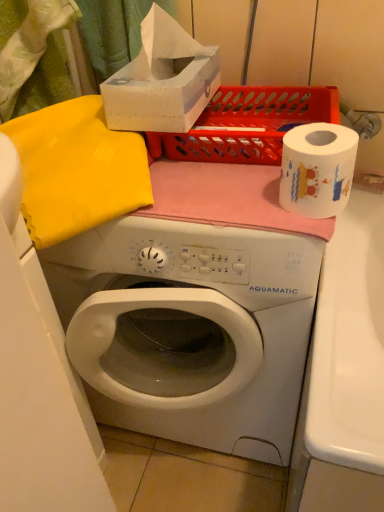
Measure the distance between white cardboard tissue box at upper center and camera.

white cardboard tissue box at upper center is 26.39 inches away from camera.

What are the coordinates of `white cardboard tissue box at upper center` in the screenshot? It's located at (162, 80).

Describe the element at coordinates (190, 329) in the screenshot. Image resolution: width=384 pixels, height=512 pixels. I see `white plastic washing machine at center` at that location.

I want to click on white cardboard tissue box at upper center, so click(162, 80).

How different are the orientations of white paper at right and matte plastic crate at upper center in degrees?

The angle between the facing direction of white paper at right and the facing direction of matte plastic crate at upper center is 0.887 degrees.

Which is more to the right, white paper at right or matte plastic crate at upper center?

From the viewer's perspective, white paper at right appears more on the right side.

From a real-world perspective, relative to matte plastic crate at upper center, is white paper at right vertically above or below?

From a real-world perspective, white paper at right is physically above matte plastic crate at upper center.

Image resolution: width=384 pixels, height=512 pixels. I want to click on box behind the white plastic washing machine at center, so click(x=162, y=80).

What's the angular difference between white plastic washing machine at center and white cardboard tissue box at upper center's facing directions?

There is a 0.887-degree angle between the facing directions of white plastic washing machine at center and white cardboard tissue box at upper center.

From their relative heights in the image, would you say white plastic washing machine at center is taller or shorter than white cardboard tissue box at upper center?

white plastic washing machine at center is taller than white cardboard tissue box at upper center.

Based on their positions, is white plastic washing machine at center located to the left or right of white cardboard tissue box at upper center?

Clearly, white plastic washing machine at center is on the right of white cardboard tissue box at upper center in the image.

Is white cardboard tissue box at upper center outside of matte plastic crate at upper center?

That's correct, white cardboard tissue box at upper center is outside of matte plastic crate at upper center.

Does point (115, 75) appear closer or farther from the camera than point (306, 94)?

Clearly, point (115, 75) is closer to the camera than point (306, 94).

Are white cardboard tissue box at upper center and matte plastic crate at upper center far apart?

white cardboard tissue box at upper center is actually quite close to matte plastic crate at upper center.

Which object is positioned more to the right, white cardboard tissue box at upper center or matte plastic crate at upper center?

matte plastic crate at upper center is more to the right.

Is white plastic washing machine at center situated inside matte plastic crate at upper center or outside?

white plastic washing machine at center exists outside the volume of matte plastic crate at upper center.

Where is `crate on the right of the white plastic washing machine at center`? crate on the right of the white plastic washing machine at center is located at coordinates (247, 124).

Considering the sizes of objects white plastic washing machine at center and matte plastic crate at upper center in the image provided, who is smaller, white plastic washing machine at center or matte plastic crate at upper center?

Smaller between the two is matte plastic crate at upper center.

Does white plastic washing machine at center touch matte plastic crate at upper center?

No, white plastic washing machine at center is not next to matte plastic crate at upper center.

Is white cardboard tissue box at upper center inside the boundaries of white plastic washing machine at center, or outside?

white cardboard tissue box at upper center is outside white plastic washing machine at center.

Is white cardboard tissue box at upper center to the left of white plastic washing machine at center from the viewer's perspective?

Indeed, white cardboard tissue box at upper center is positioned on the left side of white plastic washing machine at center.

Which object is further away from the camera, matte plastic crate at upper center or white plastic washing machine at center?

matte plastic crate at upper center.

Is matte plastic crate at upper center facing towards white plastic washing machine at center?

No, matte plastic crate at upper center is not oriented towards white plastic washing machine at center.

How far apart are matte plastic crate at upper center and white plastic washing machine at center?

matte plastic crate at upper center is 14.65 inches away from white plastic washing machine at center.

Is matte plastic crate at upper center facing away from white cardboard tissue box at upper center?

No.

Find the location of a particular element. box in front of the matte plastic crate at upper center is located at coordinates (162, 80).

Are matte plastic crate at upper center and white cardboard tissue box at upper center beside each other?

No, matte plastic crate at upper center is not with white cardboard tissue box at upper center.

Considering the positions of objects matte plastic crate at upper center and white cardboard tissue box at upper center in the image provided, who is more to the left, matte plastic crate at upper center or white cardboard tissue box at upper center?

From the viewer's perspective, white cardboard tissue box at upper center appears more on the left side.

Where is `crate above the white paper at right (from the image's perspective)`? This screenshot has height=512, width=384. crate above the white paper at right (from the image's perspective) is located at coordinates (247, 124).

Image resolution: width=384 pixels, height=512 pixels. In order to click on washing machine below the white cardboard tissue box at upper center (from a real-world perspective) in this screenshot , I will do `click(190, 329)`.

Estimate the real-world distances between objects in this image. Which object is further from matte plastic crate at upper center, white plastic washing machine at center or white cardboard tissue box at upper center?

white plastic washing machine at center is further to matte plastic crate at upper center.

Looking at this image, which object lies further to the anchor point white plastic washing machine at center, matte plastic crate at upper center or white paper at right?

Based on the image, matte plastic crate at upper center appears to be further to white plastic washing machine at center.

Considering their positions, is white paper at right positioned closer to matte plastic crate at upper center than white cardboard tissue box at upper center?

white cardboard tissue box at upper center is positioned closer to the anchor matte plastic crate at upper center.

Looking at this image, estimate the real-world distances between objects in this image. Which object is further from white plastic washing machine at center, white paper at right or matte plastic crate at upper center?

Among the two, matte plastic crate at upper center is located further to white plastic washing machine at center.

Considering their positions, is white plastic washing machine at center positioned closer to matte plastic crate at upper center than white paper at right?

white paper at right is positioned closer to the anchor matte plastic crate at upper center.

Which object lies further to the anchor point white cardboard tissue box at upper center, white paper at right or white plastic washing machine at center?

white plastic washing machine at center is positioned further to the anchor white cardboard tissue box at upper center.

From the image, which object appears to be nearer to white paper at right, matte plastic crate at upper center or white plastic washing machine at center?

matte plastic crate at upper center is closer to white paper at right.

Considering their positions, is matte plastic crate at upper center positioned further to white cardboard tissue box at upper center than white paper at right?

white paper at right is further to white cardboard tissue box at upper center.

The image size is (384, 512). What are the coordinates of `crate between white cardboard tissue box at upper center and white paper at right in the vertical direction` in the screenshot? It's located at (247, 124).

The height and width of the screenshot is (512, 384). I want to click on paper towel between matte plastic crate at upper center and white plastic washing machine at center vertically, so click(x=317, y=169).

The height and width of the screenshot is (512, 384). Find the location of `crate between white cardboard tissue box at upper center and white plastic washing machine at center in the up-down direction`. crate between white cardboard tissue box at upper center and white plastic washing machine at center in the up-down direction is located at coordinates point(247,124).

This screenshot has width=384, height=512. In order to click on paper towel between white cardboard tissue box at upper center and white plastic washing machine at center in the up-down direction in this screenshot , I will do (317, 169).